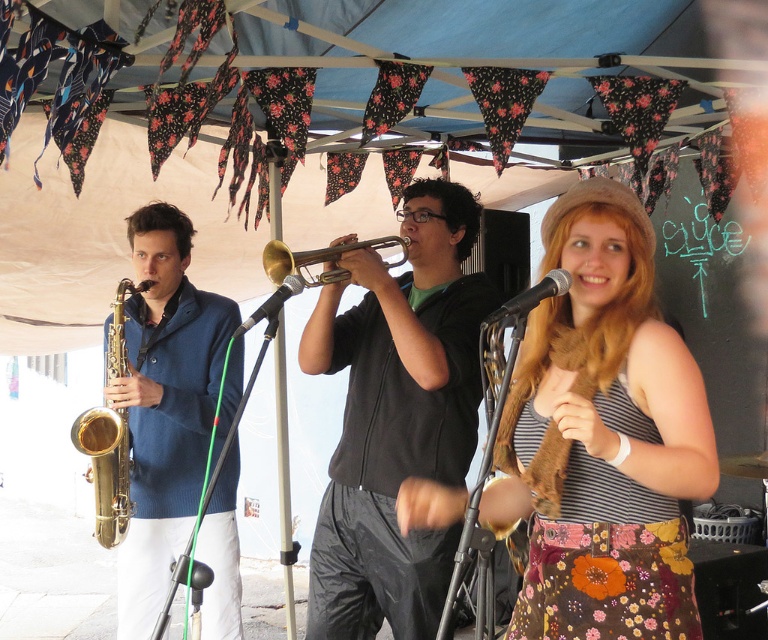
You are a music teacher setting up for a performance. You have two trumpets, the black matte trumpet at center and the gold brass trumpet at center. If you want to choose the wider one to fit into a larger trumpet case, which trumpet should you pick?

The black matte trumpet at center is wider than the gold brass trumpet at center, so you should choose the black matte trumpet at center for the larger case.

You are a photographer standing at the center of the stage. You want to take a picture of the gold shiny saxophone at left. What are the coordinates where you should aim your camera?

You should aim your camera at coordinates point (x=164, y=404) to capture the gold shiny saxophone at left.